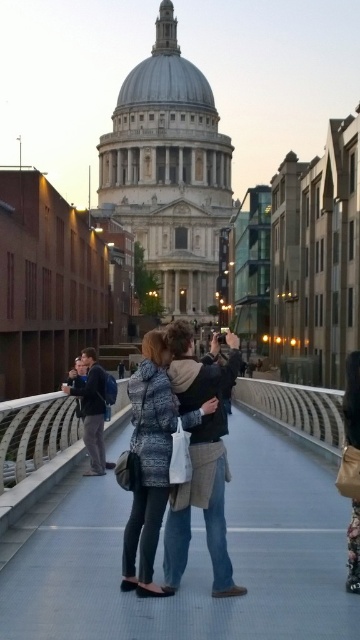
You are standing on the smooth concrete bridge at center and want to take a photo of St. Paul Cathedral. Where should you position yourself to capture the best view?

The smooth concrete bridge at center is located at point (x=189, y=557), so you should position yourself there to capture the best view of St. Paul Cathedral.